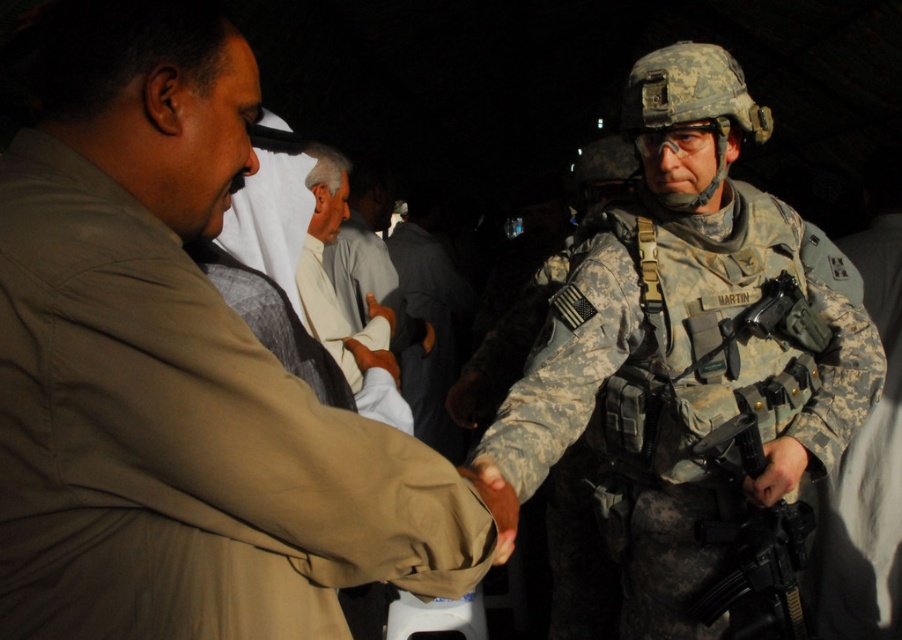
Question: Which point is closer to the camera?

Choices:
 (A) (348, 362)
 (B) (779, 454)
 (C) (673, 321)
 (D) (102, 448)

Answer: (D)

Question: Which point is closer to the camera?

Choices:
 (A) black matte rifle at right
 (B) camouflage fabric uniform at right
 (C) matte black gun at lower right

Answer: (B)

Question: Does camouflage fabric uniform at right appear on the right side of white cotton shirt at center?

Choices:
 (A) yes
 (B) no

Answer: (A)

Question: In this image, where is white cotton shirt at center located relative to matte black gun at lower right?

Choices:
 (A) above
 (B) below

Answer: (A)

Question: Which object appears farthest from the camera in this image?

Choices:
 (A) matte black gun at lower right
 (B) black matte rifle at right
 (C) tan fabric shirt at center
 (D) camouflage fabric uniform at right

Answer: (B)

Question: Where is camouflage fabric uniform at right located in relation to white cotton shirt at center in the image?

Choices:
 (A) right
 (B) left

Answer: (A)